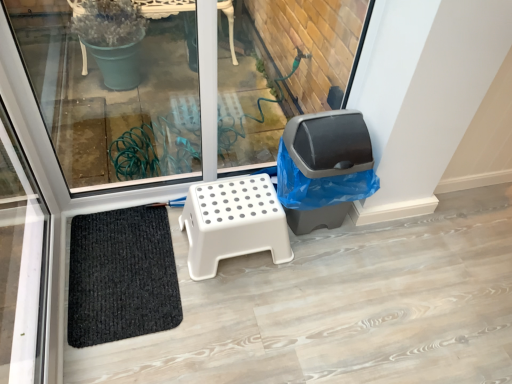
Image resolution: width=512 pixels, height=384 pixels. What are the coordinates of `vacant area that lies to the right of white plastic stool at center` in the screenshot? It's located at (319, 274).